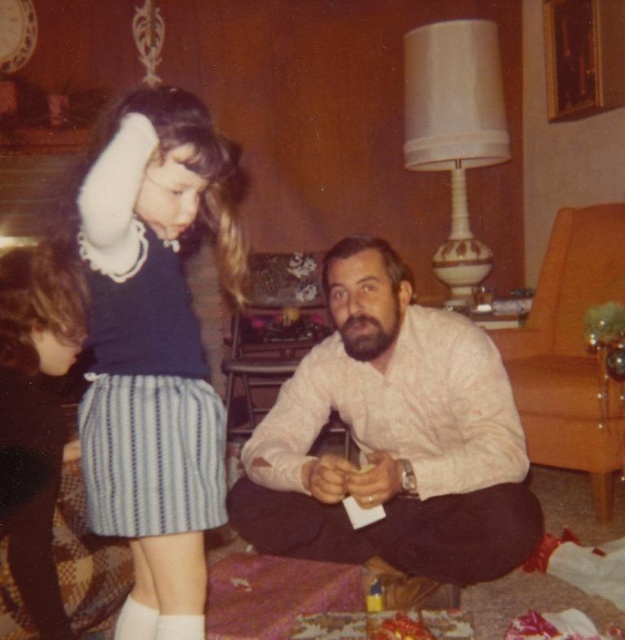
Does white textured shirt at center have a greater height compared to white soft sock at lower left?

Correct, white textured shirt at center is much taller as white soft sock at lower left.

Does point (265, 451) lie in front of point (185, 618)?

No, it is behind (185, 618).

Who is more distant from viewer, (x=351, y=268) or (x=198, y=621)?

Point (x=351, y=268)

This screenshot has width=625, height=640. What are the coordinates of `white textured shirt at center` in the screenshot? It's located at (392, 436).

Does white soft sweater at upper left have a greater width compared to white soft sock at lower left?

Yes.

Is white soft sweater at upper left behind white soft sock at lower left?

No, it is in front of white soft sock at lower left.

Where is `white soft sweater at upper left`? The height and width of the screenshot is (640, 625). white soft sweater at upper left is located at coordinates (152, 348).

Can you confirm if orange fabric armchair at right is positioned to the left of white soft sock at lower left?

Incorrect, orange fabric armchair at right is not on the left side of white soft sock at lower left.

Locate an element on the screen. The image size is (625, 640). orange fabric armchair at right is located at coordinates (571, 353).